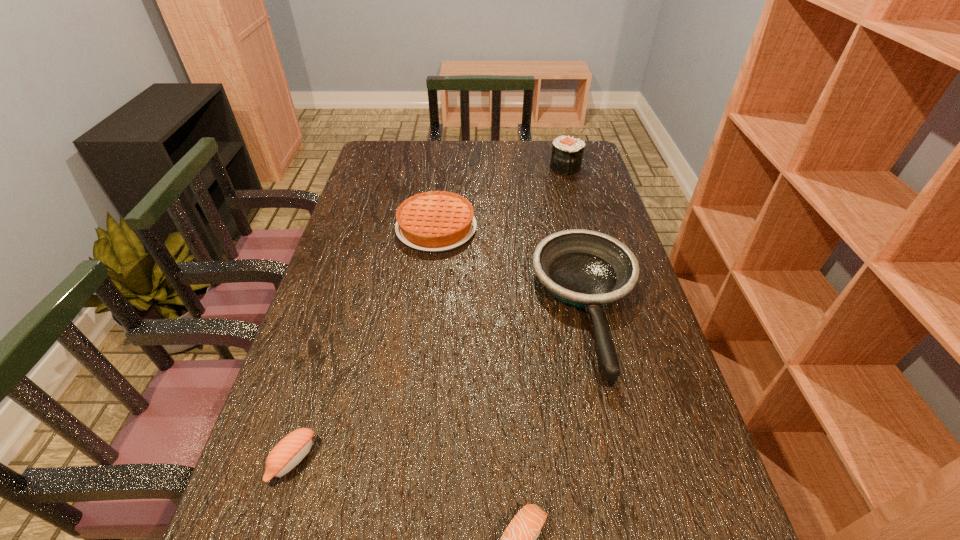
In order to click on free space between the frying pan and the pie in this screenshot , I will do `click(513, 268)`.

This screenshot has width=960, height=540. In order to click on vacant point located between the second farthest sushi and the frying pan in this screenshot , I will do `click(441, 384)`.

Where is `vacant area that lies between the second nearest object and the frying pan`? vacant area that lies between the second nearest object and the frying pan is located at coordinates (441, 384).

Where is `object that is the third nearest to the farthest object`? The width and height of the screenshot is (960, 540). object that is the third nearest to the farthest object is located at coordinates (519, 539).

Where is `object that is the fourth closest to the third object from left to right`? This screenshot has width=960, height=540. object that is the fourth closest to the third object from left to right is located at coordinates (567, 153).

What are the coordinates of `sushi identified as the closest to the shortest sushi` in the screenshot? It's located at (289, 452).

Identify which sushi is the closest to the second nearest object. Please provide its 2D coordinates. Your answer should be formatted as a tuple, i.e. [(x, y)], where the tuple contains the x and y coordinates of a point satisfying the conditions above.

[(519, 539)]